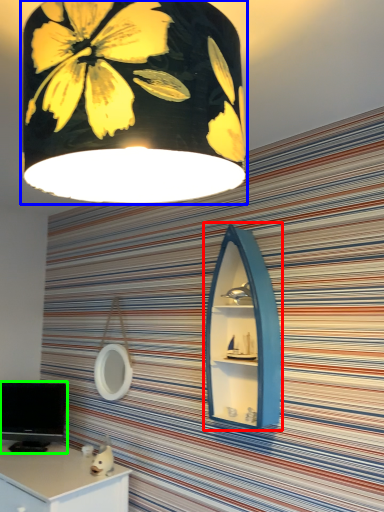
Question: Which object is positioned closest to medicine cabinet (highlighted by a red box)? Select from lamp (highlighted by a blue box) and computer monitor (highlighted by a green box).

Choices:
 (A) lamp
 (B) computer monitor

Answer: (A)